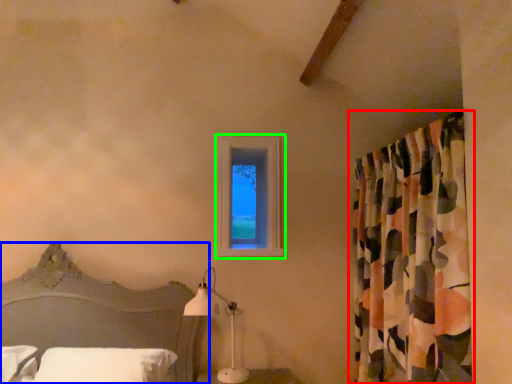
Question: Based on their relative distances, which object is farther from curtain (highlighted by a red box)? Choose from bed (highlighted by a blue box) and window (highlighted by a green box).

Choices:
 (A) bed
 (B) window

Answer: (A)